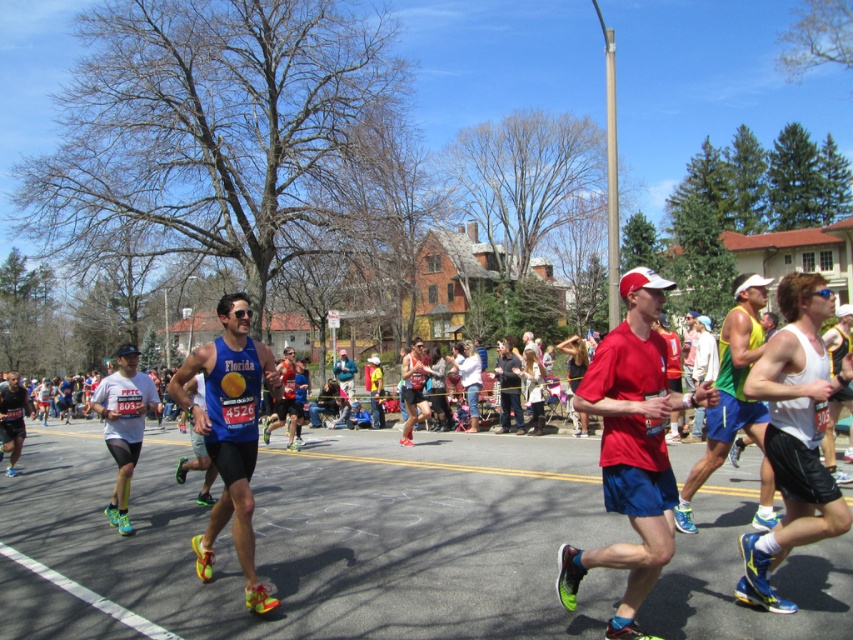
You are a photographer capturing the marathon runners. You notice the blue fabric tank top at center and the white matte running shorts at center. Which piece of clothing takes up more visual space in your photo?

The white matte running shorts at center takes up more visual space than the blue fabric tank top at center.

You are a photographer standing at the starting line of the marathon. You want to take a closeup shot of the blue fabric tank top at center. What is the minimum distance you need to move forward to get the shot?

The blue fabric tank top at center is currently 16.35 feet away from the camera. To take a closeup shot, you would need to move forward to reduce the distance. However, the exact distance to move depends on the camera lens and desired framing, but the minimum distance required to be closer would be less than 16.35 feet.

You are a photographer standing at the starting line of the marathon. You want to take a photo that includes both the point at coordinate point (9, 420) and the point at coordinate point (512, 387). Which point will appear closer to the edge of the photo frame?

Point (9, 420) is closer to the camera than point (512, 387), so it will appear closer to the edge of the photo frame.